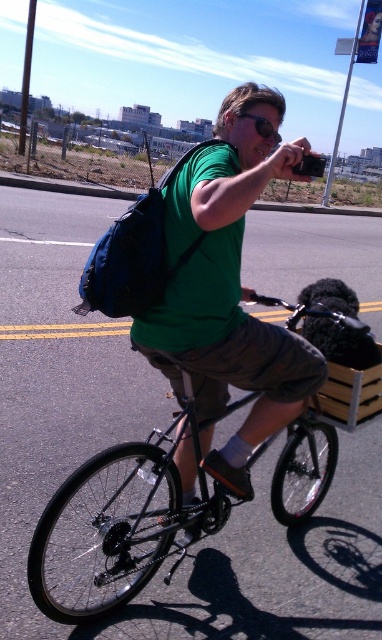
Question: Does green matte shirt at center come in front of black matte bicycle at center?

Choices:
 (A) yes
 (B) no

Answer: (A)

Question: Is green matte shirt at center to the left of black matte bicycle at center from the viewer's perspective?

Choices:
 (A) yes
 (B) no

Answer: (B)

Question: Among these points, which one is nearest to the camera?

Choices:
 (A) (367, 388)
 (B) (194, 458)

Answer: (B)

Question: Which object is farther from the camera taking this photo?

Choices:
 (A) black matte bicycle at center
 (B) green matte shirt at center

Answer: (A)

Question: Does green matte shirt at center have a lesser width compared to black matte bicycle at center?

Choices:
 (A) no
 (B) yes

Answer: (B)

Question: Which of the following is the closest to the observer?

Choices:
 (A) (242, 314)
 (B) (265, 301)

Answer: (A)